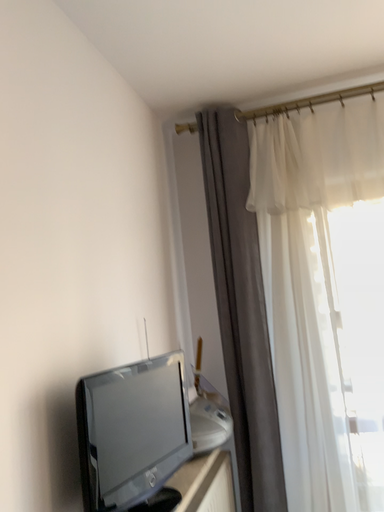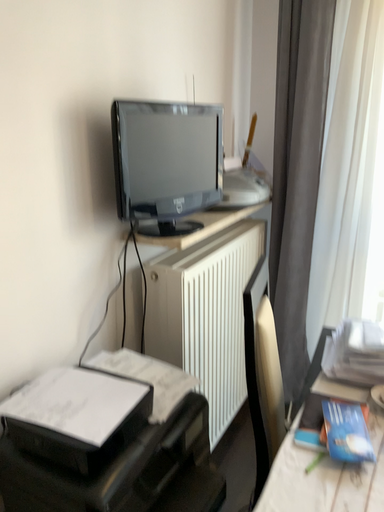
Question: How did the camera likely rotate when shooting the video?

Choices:
 (A) rotated left
 (B) rotated right

Answer: (A)